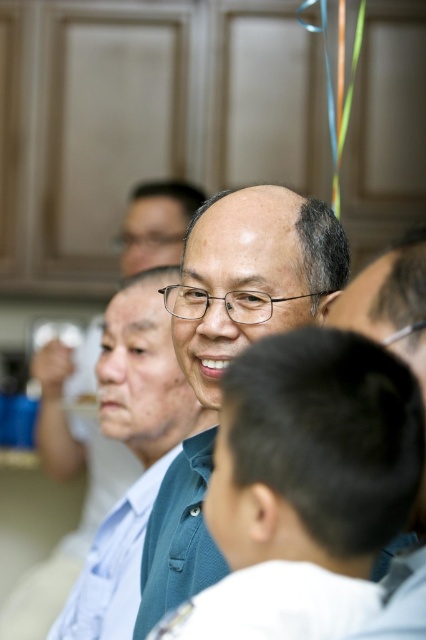
Question: Which point appears farthest from the camera in this image?

Choices:
 (A) (144, 448)
 (B) (201, 337)

Answer: (A)

Question: Does green matte shirt at center have a greater width compared to matte blue shirt at center?

Choices:
 (A) yes
 (B) no

Answer: (B)

Question: Among these objects, which one is farthest from the camera?

Choices:
 (A) matte blue shirt at center
 (B) green matte shirt at center

Answer: (A)

Question: Does green matte shirt at center have a smaller size compared to matte blue shirt at center?

Choices:
 (A) no
 (B) yes

Answer: (B)

Question: Does green matte shirt at center have a smaller size compared to matte blue shirt at center?

Choices:
 (A) no
 (B) yes

Answer: (B)